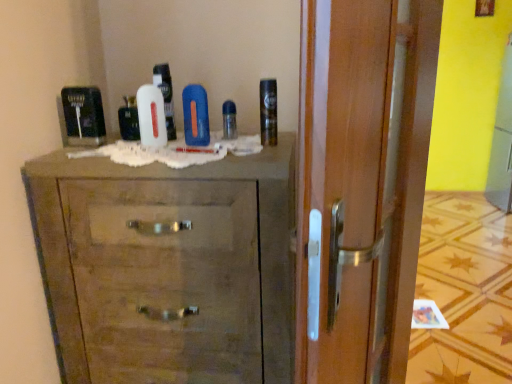
You are a GUI agent. You are given a task and a screenshot of the screen. Output one action in this format:
    pyautogui.click(x=<x>, y=<y>)
    Task: Click on the free space in front of white glossy mouthwash at center, which is the 2th mouthwash from right to left
    The height and width of the screenshot is (384, 512).
    Given the screenshot: What is the action you would take?
    pyautogui.click(x=123, y=145)